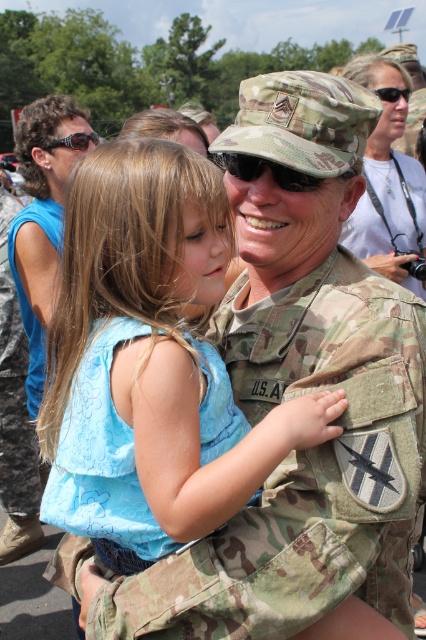
Question: Does camouflage uniform at center appear over shiny brown goggles at upper left?

Choices:
 (A) no
 (B) yes

Answer: (A)

Question: Among these objects, which one is farthest from the camera?

Choices:
 (A) camouflage uniform at center
 (B) black matte goggles at center

Answer: (A)

Question: Can you confirm if camouflage uniform at center is positioned below matte white shirt at upper center?

Choices:
 (A) no
 (B) yes

Answer: (B)

Question: Which object appears farthest from the camera in this image?

Choices:
 (A) blue fabric dress at center
 (B) matte white shirt at upper center
 (C) blue fabric shirt at left
 (D) camouflage uniform at center

Answer: (C)

Question: Does matte white shirt at upper center appear on the right side of blue fabric shirt at left?

Choices:
 (A) yes
 (B) no

Answer: (A)

Question: Which point is closer to the camera?

Choices:
 (A) (85, 147)
 (B) (14, 204)

Answer: (A)